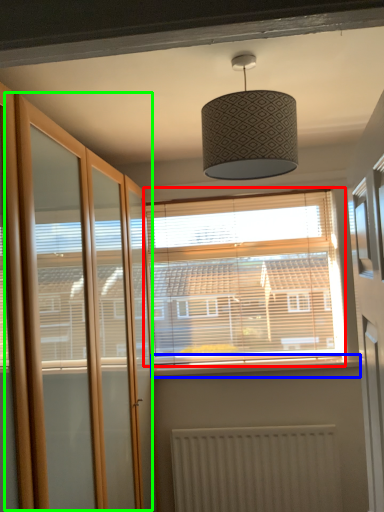
Question: Which is nearer to the window (highlighted by a red box)? window sill (highlighted by a blue box) or screen door (highlighted by a green box).

Choices:
 (A) window sill
 (B) screen door

Answer: (A)